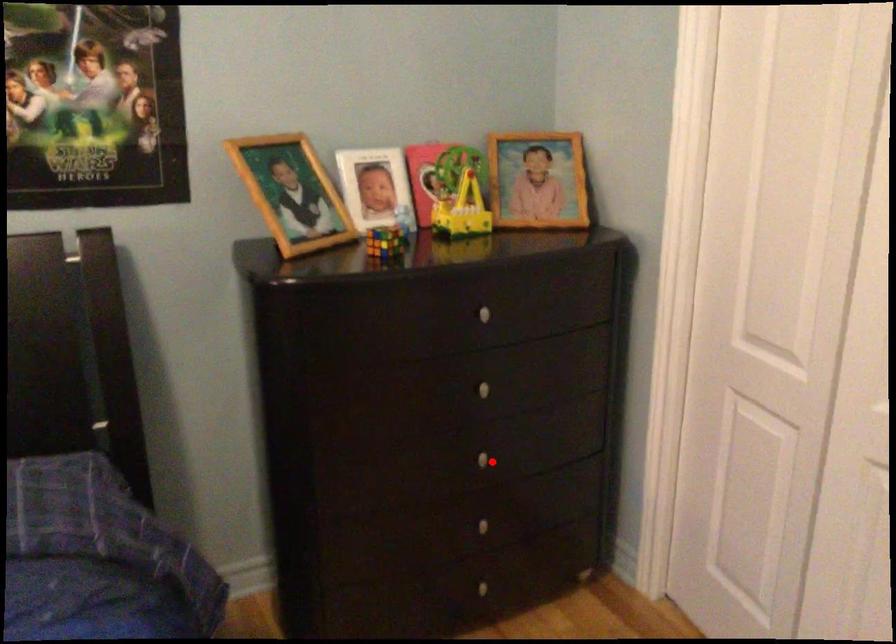
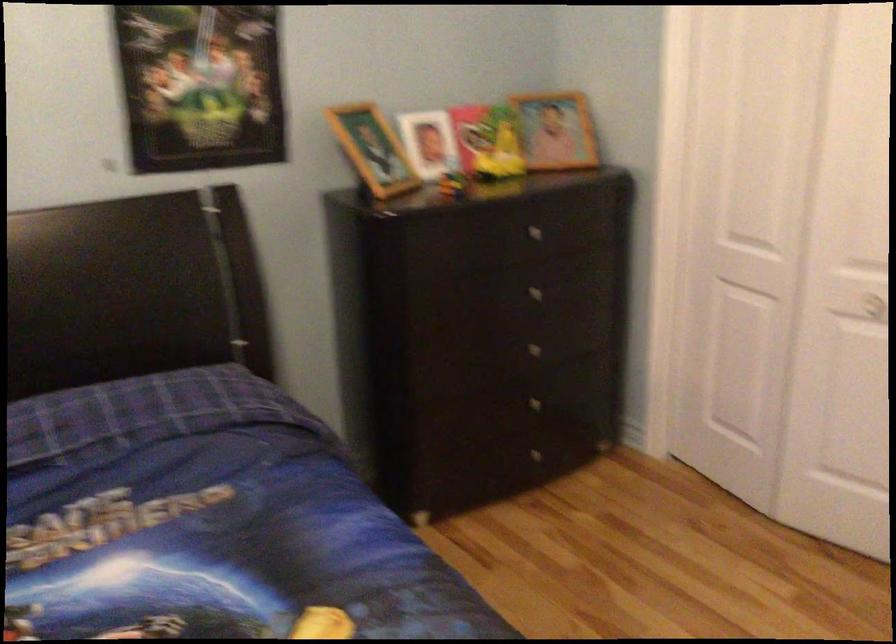
Find the pixel in the second image that matches the highlighted location in the first image.

(539, 353)